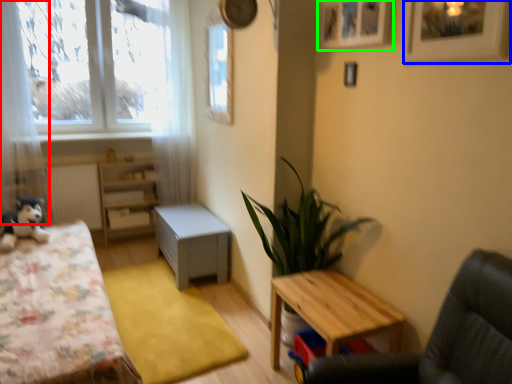
Question: Which is farther away from curtain (highlighted by a red box)? picture frame (highlighted by a blue box) or picture frame (highlighted by a green box)?

Choices:
 (A) picture frame
 (B) picture frame

Answer: (A)